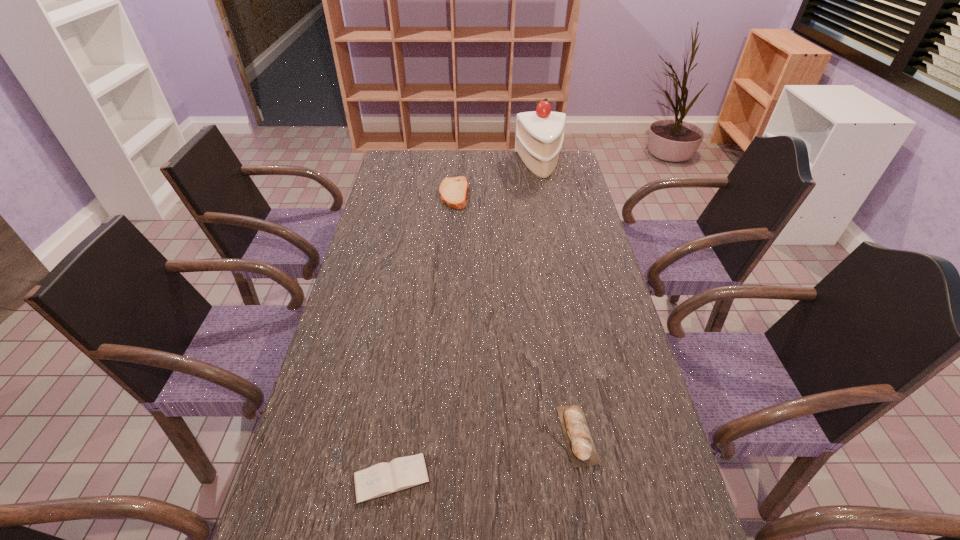
The image size is (960, 540). Identify the location of free point between the right pita bread and the tallest object. (559, 300).

Locate an element on the screen. free space between the left pita bread and the right pita bread is located at coordinates (516, 314).

The image size is (960, 540). What are the coordinates of `free area in between the tallest object and the farther pita bread` in the screenshot? It's located at (497, 179).

Locate an element on the screen. The width and height of the screenshot is (960, 540). vacant point located between the farther pita bread and the right pita bread is located at coordinates (516, 314).

You are a GUI agent. You are given a task and a screenshot of the screen. Output one action in this format:
    pyautogui.click(x=<x>, y=<y>)
    Task: Click on the vacant point located between the shortest object and the farther pita bread
    
    Given the screenshot: What is the action you would take?
    pyautogui.click(x=422, y=336)

This screenshot has width=960, height=540. I want to click on unoccupied position between the tallest object and the diary, so click(x=467, y=321).

Locate an element on the screen. free area in between the farther pita bread and the cake is located at coordinates (497, 179).

The width and height of the screenshot is (960, 540). I want to click on vacant space that is in between the left pita bread and the right pita bread, so click(x=516, y=314).

Identify which object is the nearest to the shortest object. Please provide its 2D coordinates. Your answer should be formatted as a tuple, i.e. [(x, y)], where the tuple contains the x and y coordinates of a point satisfying the conditions above.

[(578, 438)]

Locate which object ranks in proximity to the farther pita bread. Please provide its 2D coordinates. Your answer should be formatted as a tuple, i.e. [(x, y)], where the tuple contains the x and y coordinates of a point satisfying the conditions above.

[(539, 137)]